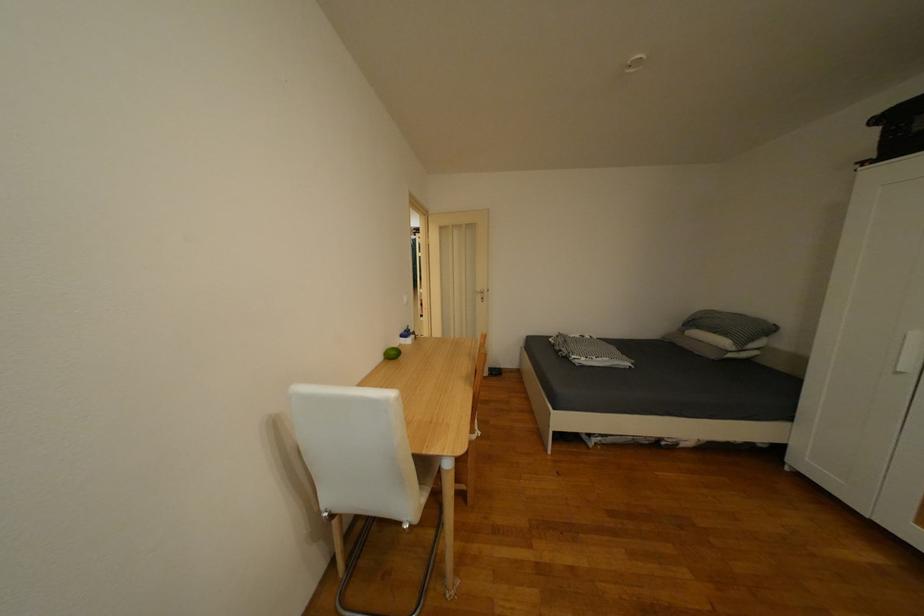
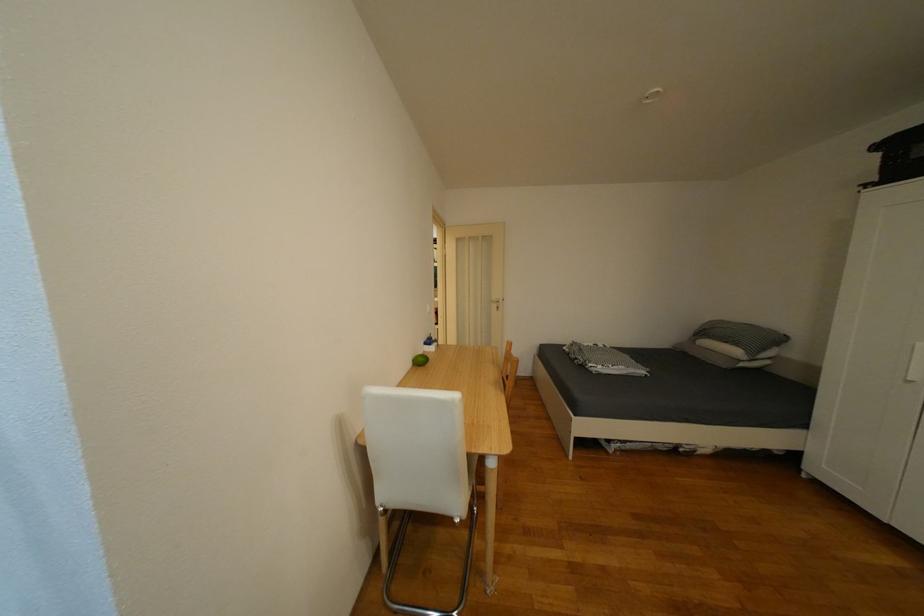
Locate, in the second image, the point that corresponds to the point at 602,359 in the first image.

(618, 368)